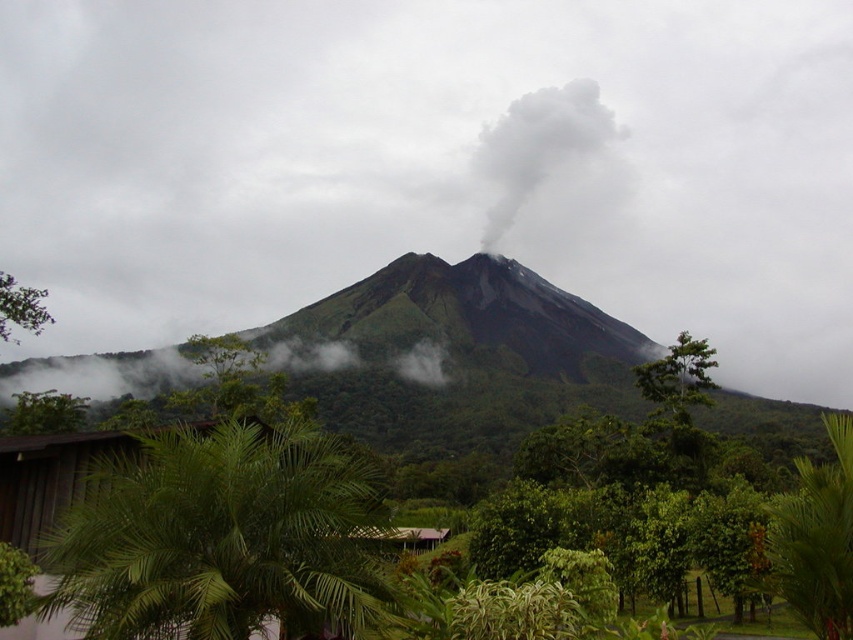
Question: Does green leafy palm at lower left have a greater width compared to green leafy tree at lower left?

Choices:
 (A) yes
 (B) no

Answer: (B)

Question: Among these objects, which one is farthest from the camera?

Choices:
 (A) gray ash cloud at center
 (B) green leafy palm at lower left

Answer: (A)

Question: Which point is closer to the camera taking this photo?

Choices:
 (A) (6, 273)
 (B) (213, 625)
 (C) (512, 164)
 (D) (86, 243)

Answer: (B)

Question: Considering the real-world distances, which object is farthest from the green leafy palm at lower left?

Choices:
 (A) white smoke at center
 (B) gray ash cloud at center

Answer: (A)

Question: Is white smoke at center further to the viewer compared to green leafy tree at lower left?

Choices:
 (A) yes
 (B) no

Answer: (A)

Question: Observing the image, what is the correct spatial positioning of gray ash cloud at center in reference to white smoke at center?

Choices:
 (A) right
 (B) left

Answer: (B)